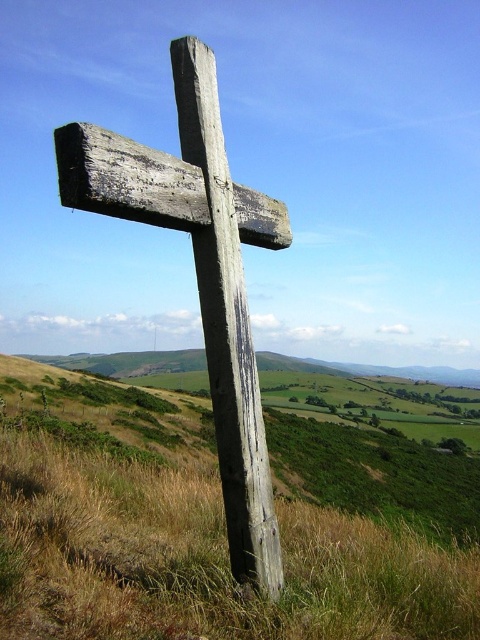
Question: Can you confirm if dry grass at center is positioned above weathered wood cross at center?

Choices:
 (A) no
 (B) yes

Answer: (A)

Question: Can you confirm if dry grass at center is bigger than weathered wood cross at center?

Choices:
 (A) no
 (B) yes

Answer: (A)

Question: Which point appears closest to the camera in this image?

Choices:
 (A) (71, 628)
 (B) (129, 205)

Answer: (A)

Question: Does dry grass at center come behind weathered wood cross at center?

Choices:
 (A) yes
 (B) no

Answer: (B)